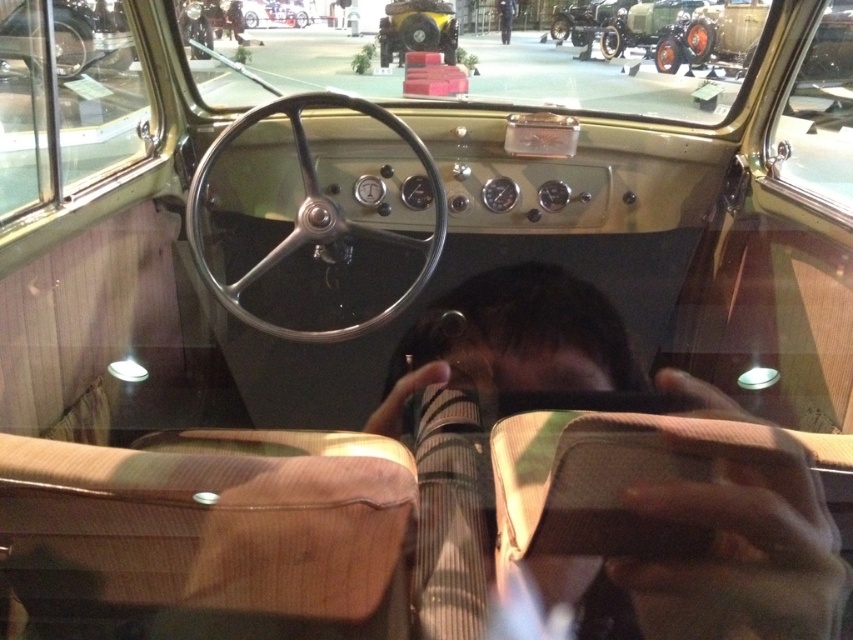
You are a passenger in the vintage car and want to place your dark brown leather jacket at center and black fabric pants at center on the seat. Based on their positions, which item is closer to the floor?

The dark brown leather jacket at center is positioned under the black fabric pants at center, so it is closer to the floor.

You are a passenger in the vintage car and need to place both the dark brown leather jacket at center and the black fabric pants at center on the seat. Which item will take up more space on the seat?

The dark brown leather jacket at center has a larger size compared to the black fabric pants at center, so it will take up more space on the seat.

Based on the photo, you are a passenger in the vintage car and need to reach the black fabric pants at center to retrieve your keys. The dark brown leather jacket at center is blocking your path. Can you safely move the jacket to access the pants without damaging the car?

The dark brown leather jacket at center and black fabric pants at center are 7.47 meters apart, so there is sufficient space between them to move the jacket without causing damage to the car.